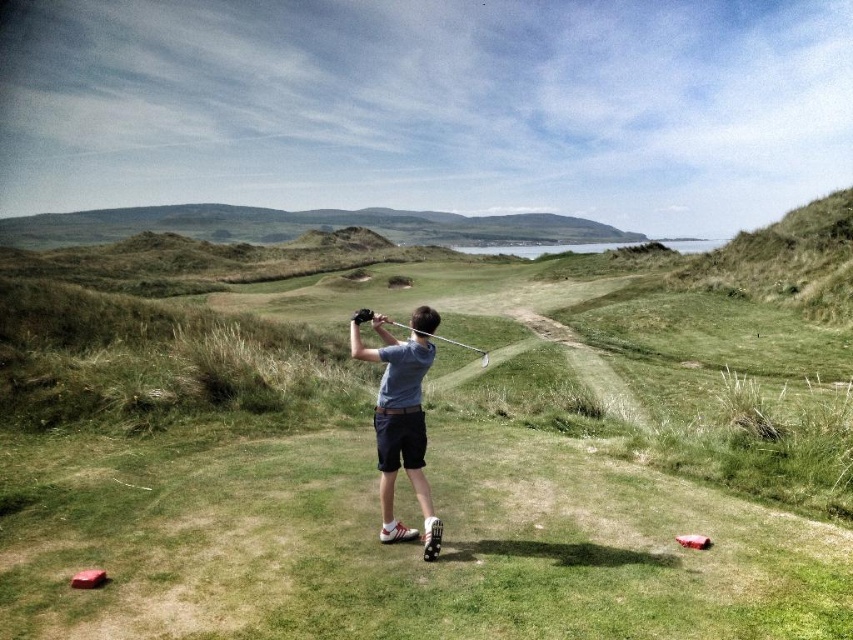
Question: Is gray cotton shirt at center below metallic silver golf club at center?

Choices:
 (A) yes
 (B) no

Answer: (A)

Question: Considering the relative positions of gray cotton shirt at center and metallic silver golf club at center in the image provided, where is gray cotton shirt at center located with respect to metallic silver golf club at center?

Choices:
 (A) below
 (B) above

Answer: (A)

Question: Among these points, which one is nearest to the camera?

Choices:
 (A) (392, 428)
 (B) (466, 344)

Answer: (A)

Question: Which point is closer to the camera taking this photo?

Choices:
 (A) (404, 465)
 (B) (364, 320)

Answer: (B)

Question: Which object appears farthest from the camera in this image?

Choices:
 (A) metallic silver golf club at center
 (B) gray cotton shirt at center

Answer: (A)

Question: Is gray cotton shirt at center positioned in front of metallic silver golf club at center?

Choices:
 (A) yes
 (B) no

Answer: (A)